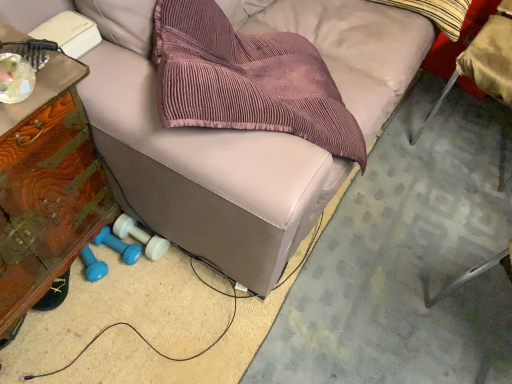
Question: Is point (485, 36) positioned closer to the camera than point (139, 251)?

Choices:
 (A) farther
 (B) closer

Answer: (A)

Question: From a real-world perspective, is metallic silver chair at lower right positioned above or below blue rubber dumbbell at lower left, acting as the 2th dumbbell starting from the right?

Choices:
 (A) above
 (B) below

Answer: (A)

Question: Which of these objects is positioned farthest from the wooden side table at left, the first furniture in the left-to-right sequence?

Choices:
 (A) metallic silver chair at lower right
 (B) striped cotton throw pillow at upper right
 (C) blue rubber dumbbell at lower left, the 2th dumbbell in the left-to-right sequence
 (D) leather couch at center, arranged as the first furniture when viewed from the right
 (E) blue rubber dumbbell at lower left, acting as the 2th dumbbell starting from the right

Answer: (B)

Question: Which object is the closest to the metallic silver chair at lower right?

Choices:
 (A) leather couch at center, which is the second furniture from left to right
 (B) blue rubber dumbbell at lower left, arranged as the 1th dumbbell when viewed from the right
 (C) wooden side table at left, the second furniture positioned from the right
 (D) blue rubber dumbbell at lower left, acting as the 2th dumbbell starting from the right
 (E) striped cotton throw pillow at upper right

Answer: (E)